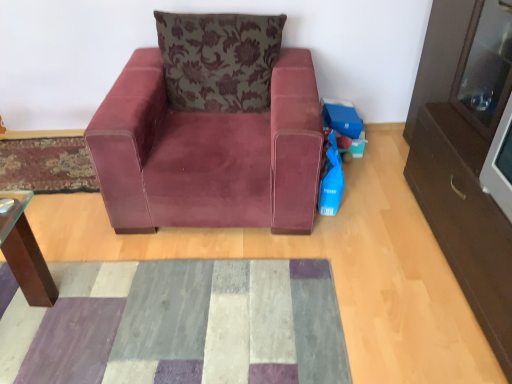
At what (x,y) coordinates should I click in order to perform the action: click on free space above velvet-like rug at lower left, which appears as the 1th mat when viewed from the left (from a real-world perspective). Please return your answer as a coordinate pair (x, y). The image size is (512, 384). Looking at the image, I should click on (40, 157).